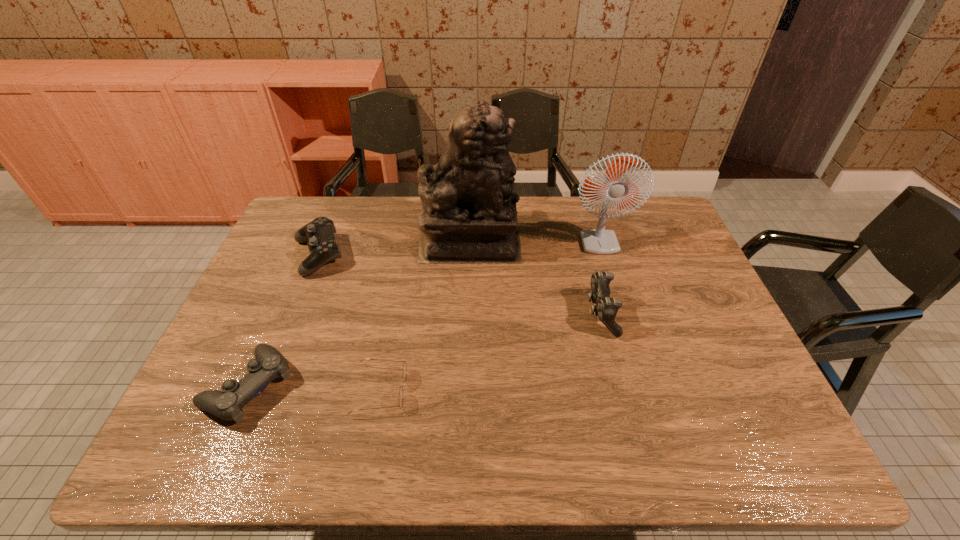
Where is `vacant space in between the second shortest control and the shortest object`? Image resolution: width=960 pixels, height=540 pixels. vacant space in between the second shortest control and the shortest object is located at coordinates (349, 323).

Where is `free space between the third tallest object and the shortest object`? free space between the third tallest object and the shortest object is located at coordinates (491, 352).

Locate an element on the screen. The image size is (960, 540). free spot between the tallest object and the third tallest object is located at coordinates (536, 278).

Where is `free spot between the shortest object and the farthest control`? free spot between the shortest object and the farthest control is located at coordinates (349, 323).

You are a GUI agent. You are given a task and a screenshot of the screen. Output one action in this format:
    pyautogui.click(x=<x>, y=<y>)
    Task: Click on the vacant point located between the fan and the shortest control
    The width and height of the screenshot is (960, 540).
    Given the screenshot: What is the action you would take?
    pyautogui.click(x=429, y=306)

The image size is (960, 540). I want to click on empty space between the spectacles and the third nearest object, so click(491, 352).

You are a GUI agent. You are given a task and a screenshot of the screen. Output one action in this format:
    pyautogui.click(x=<x>, y=<y>)
    Task: Click on the empty location between the fan and the tallest control
    This screenshot has height=540, width=960.
    Given the screenshot: What is the action you would take?
    pyautogui.click(x=605, y=271)

Image resolution: width=960 pixels, height=540 pixels. Find the location of `free spot between the fourth tallest object and the second shortest object`. free spot between the fourth tallest object and the second shortest object is located at coordinates (283, 321).

Find the location of a particular element. The height and width of the screenshot is (540, 960). blank region between the second tallest control and the tallest object is located at coordinates (395, 249).

Locate an element on the screen. The height and width of the screenshot is (540, 960). vacant point located between the second tallest object and the spectacles is located at coordinates pyautogui.click(x=495, y=308).